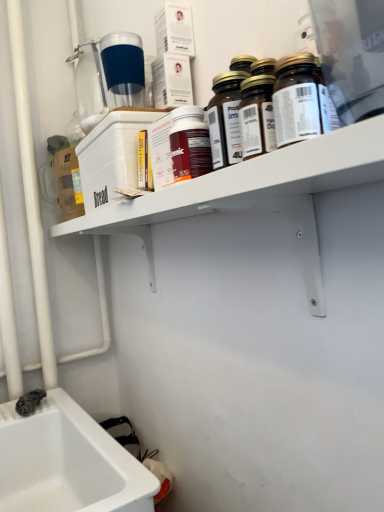
Question: From the image's perspective, is translucent glass bottles at upper center, the second bottle in the front-to-back sequence, on top of translucent glass bottles at upper right, which ranks as the 3th bottle in back-to-front order?

Choices:
 (A) no
 (B) yes

Answer: (A)

Question: Can you confirm if translucent glass bottles at upper center, the second bottle in the front-to-back sequence, is taller than translucent glass bottles at upper right, which is the third bottle from front to back?

Choices:
 (A) no
 (B) yes

Answer: (A)

Question: Is translucent glass bottles at upper center, the second bottle in the front-to-back sequence, far away from translucent glass bottles at upper right, which is the third bottle from front to back?

Choices:
 (A) no
 (B) yes

Answer: (A)

Question: Could translucent glass bottles at upper right, which ranks as the 3th bottle in back-to-front order, be considered to be inside translucent glass bottles at upper center, which is the fourth bottle from back to front?

Choices:
 (A) no
 (B) yes

Answer: (A)

Question: Is translucent glass bottles at upper center, the second bottle in the front-to-back sequence, facing towards translucent glass bottles at upper right, which ranks as the 3th bottle in back-to-front order?

Choices:
 (A) yes
 (B) no

Answer: (B)

Question: From the image's perspective, is translucent glass bottles at upper center, which is the fourth bottle from back to front, under translucent glass bottles at upper right, which is the third bottle from front to back?

Choices:
 (A) no
 (B) yes

Answer: (B)

Question: Considering the relative positions of brown glass bottle at upper center, arranged as the first bottle when viewed from the front, and transparent plastic bottle at upper center, marked as the first bottle in a back-to-front arrangement, in the image provided, is brown glass bottle at upper center, arranged as the first bottle when viewed from the front, to the right of transparent plastic bottle at upper center, marked as the first bottle in a back-to-front arrangement, from the viewer's perspective?

Choices:
 (A) no
 (B) yes

Answer: (B)

Question: Does brown glass bottle at upper center, the fifth bottle positioned from the back, lie in front of transparent plastic bottle at upper center, positioned as the fifth bottle in front-to-back order?

Choices:
 (A) no
 (B) yes

Answer: (B)

Question: Can you confirm if brown glass bottle at upper center, the fifth bottle positioned from the back, is positioned to the left of transparent plastic bottle at upper center, marked as the first bottle in a back-to-front arrangement?

Choices:
 (A) yes
 (B) no

Answer: (B)

Question: Would you say brown glass bottle at upper center, arranged as the first bottle when viewed from the front, is outside transparent plastic bottle at upper center, marked as the first bottle in a back-to-front arrangement?

Choices:
 (A) no
 (B) yes

Answer: (B)

Question: Considering the relative positions of brown glass bottle at upper center, arranged as the first bottle when viewed from the front, and transparent plastic bottle at upper center, positioned as the fifth bottle in front-to-back order, in the image provided, is brown glass bottle at upper center, arranged as the first bottle when viewed from the front, behind transparent plastic bottle at upper center, positioned as the fifth bottle in front-to-back order,?

Choices:
 (A) no
 (B) yes

Answer: (A)

Question: Is brown glass bottle at upper center, the fifth bottle positioned from the back, thinner than transparent plastic bottle at upper center, positioned as the fifth bottle in front-to-back order?

Choices:
 (A) yes
 (B) no

Answer: (A)

Question: Considering the relative positions of transparent plastic bottle at upper center, positioned as the fifth bottle in front-to-back order, and white plastic shelf at upper center in the image provided, is transparent plastic bottle at upper center, positioned as the fifth bottle in front-to-back order, to the left of white plastic shelf at upper center from the viewer's perspective?

Choices:
 (A) no
 (B) yes

Answer: (B)